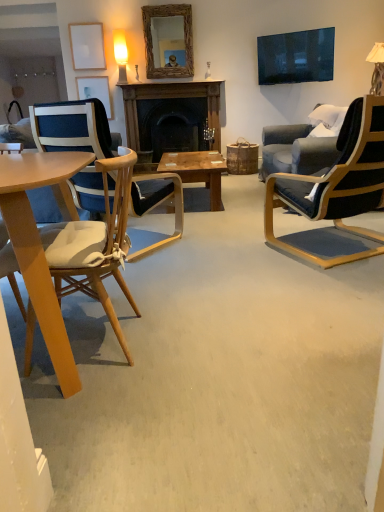
Identify the location of vacant region to the right of light brown wood chair at left, which appears as the 2th chair when viewed from the left. The image size is (384, 512). (196, 338).